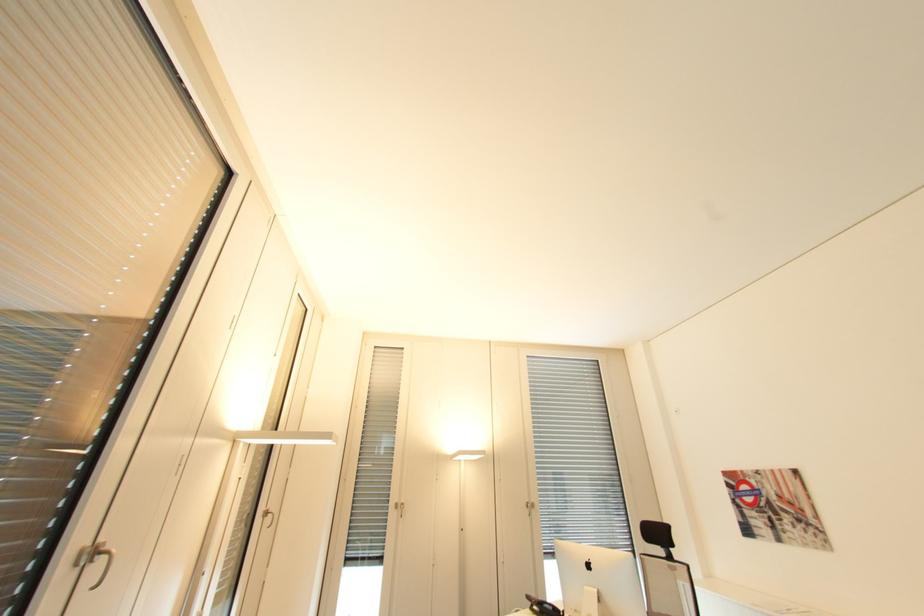
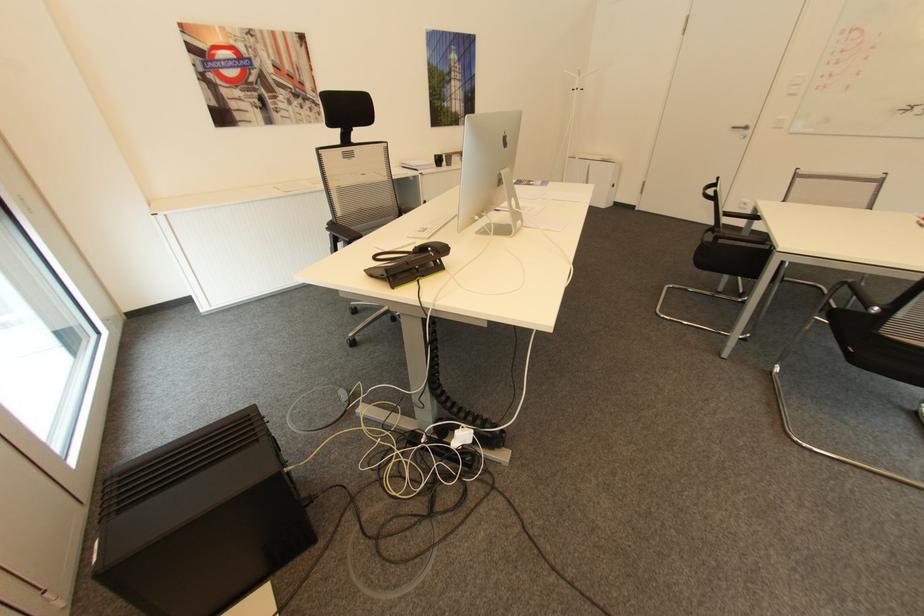
Locate, in the second image, the point that corresponds to [825,529] in the first image.

(322, 102)